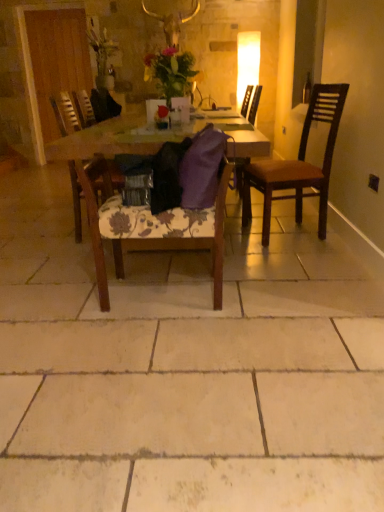
You are a GUI agent. You are given a task and a screenshot of the screen. Output one action in this format:
    pyautogui.click(x=<x>, y=<y>)
    Task: Click on the free space that is to the left of wooden chair at center, which ranks as the second chair in left-to-right order
    The height and width of the screenshot is (512, 384).
    Given the screenshot: What is the action you would take?
    pyautogui.click(x=62, y=298)